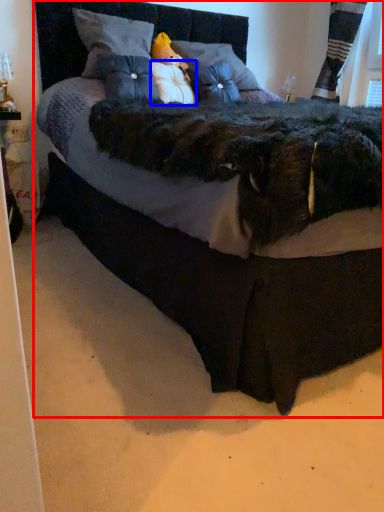
Question: Which object appears farthest to the camera in this image, bed (highlighted by a red box) or pillow (highlighted by a blue box)?

Choices:
 (A) bed
 (B) pillow

Answer: (B)